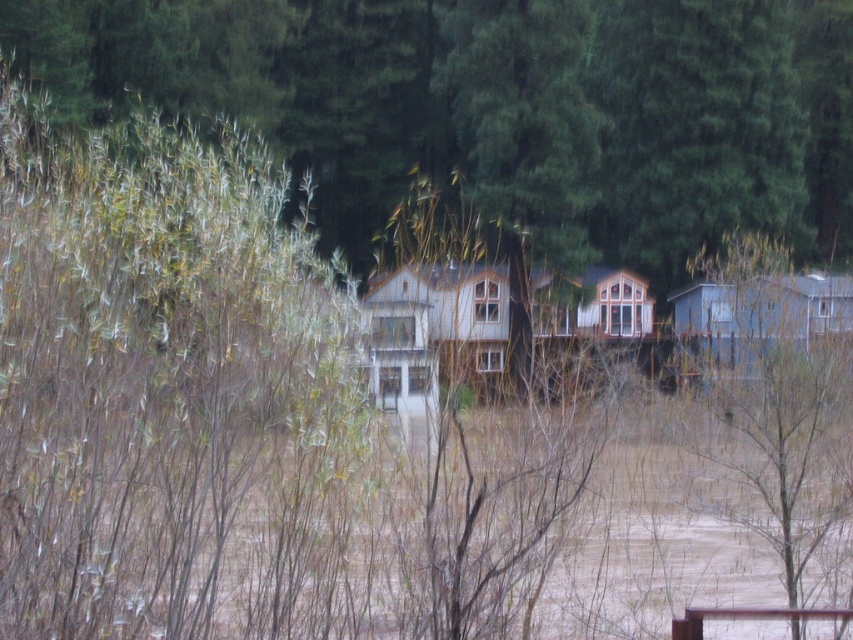
Question: Does green matte tree at right have a greater width compared to white wood cabin at center?

Choices:
 (A) yes
 (B) no

Answer: (A)

Question: Among these points, which one is farthest from the camera?

Choices:
 (A) (393, 333)
 (B) (762, 298)

Answer: (B)

Question: Is green matte tree at right above white wood cabin at center?

Choices:
 (A) no
 (B) yes

Answer: (B)

Question: Estimate the real-world distances between objects in this image. Which object is farther from the blue wood cabin at right?

Choices:
 (A) white wood cabin at center
 (B) green matte tree at right

Answer: (A)

Question: Where is green matte tree at right located in relation to blue wood cabin at right in the image?

Choices:
 (A) below
 (B) above

Answer: (B)

Question: Which is nearer to the green matte tree at right?

Choices:
 (A) blue wood cabin at right
 (B) white wood cabin at center

Answer: (A)